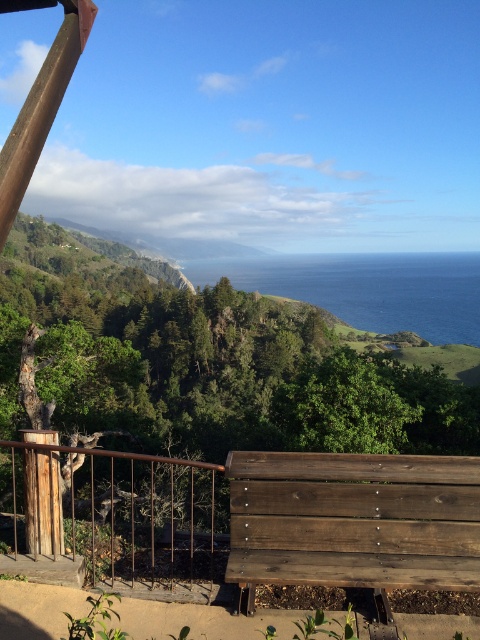
The height and width of the screenshot is (640, 480). What do you see at coordinates (354, 520) in the screenshot?
I see `dark brown wooden bench at lower center` at bounding box center [354, 520].

Between dark brown wooden bench at lower center and blue water at center, which one is positioned higher?

blue water at center

The height and width of the screenshot is (640, 480). What do you see at coordinates (354, 520) in the screenshot? I see `dark brown wooden bench at lower center` at bounding box center [354, 520].

The image size is (480, 640). In order to click on dark brown wooden bench at lower center in this screenshot , I will do `click(354, 520)`.

Does rusty metal rail at lower left have a smaller size compared to blue water at center?

Yes.

Is rusty metal rail at lower left above blue water at center?

Incorrect, rusty metal rail at lower left is not positioned above blue water at center.

Where is `rusty metal rail at lower left`? The height and width of the screenshot is (640, 480). rusty metal rail at lower left is located at coordinates (115, 520).

Is dark brown wooden bench at lower center bigger than rusty metal rail at lower left?

No, dark brown wooden bench at lower center is not bigger than rusty metal rail at lower left.

At what (x,y) coordinates should I click in order to perform the action: click on dark brown wooden bench at lower center. Please return your answer as a coordinate pair (x, y). Looking at the image, I should click on (354, 520).